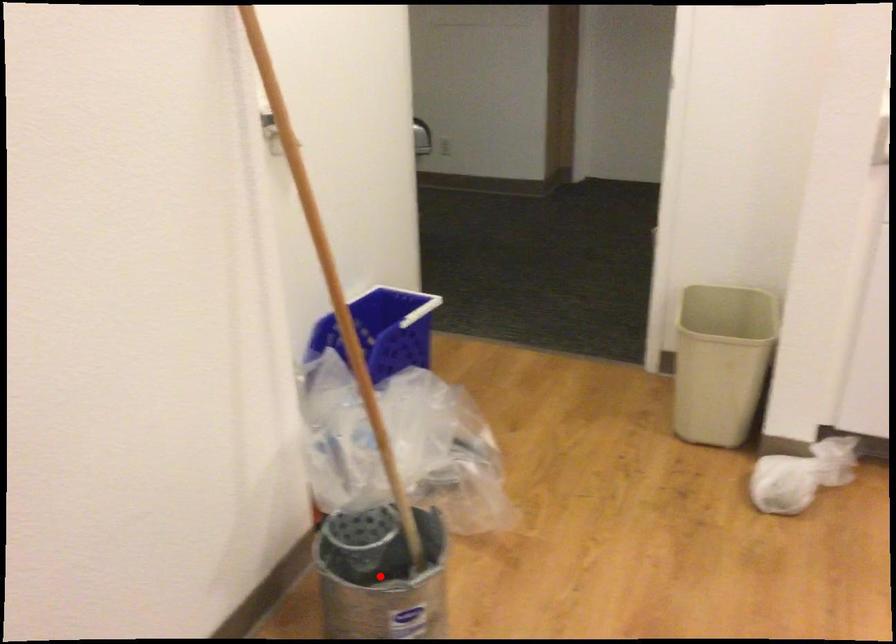
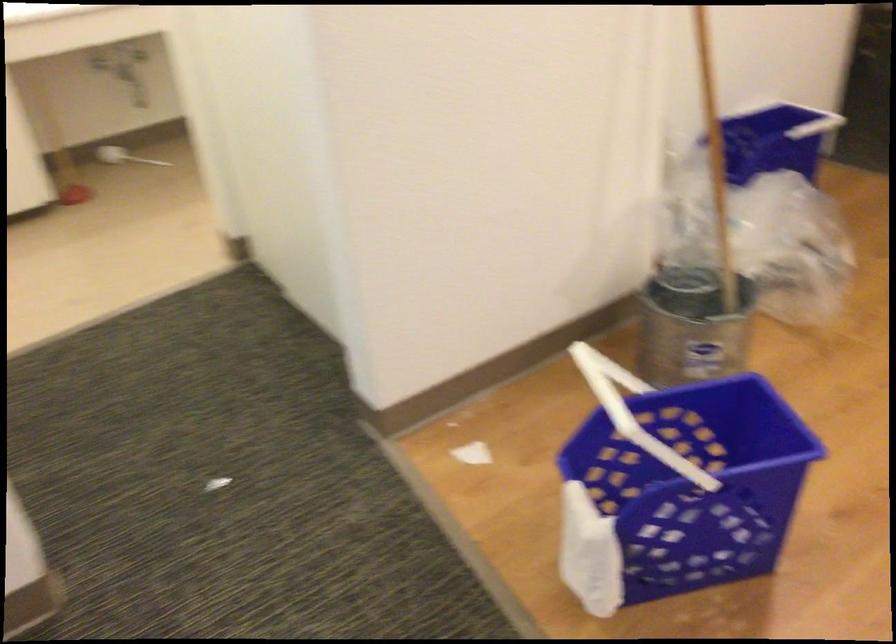
Question: I am providing you with two images of the same scene from different viewpoints. A red point is marked on the first image. Can you still see the location of the red point in image 2?

Choices:
 (A) Yes
 (B) No

Answer: (B)